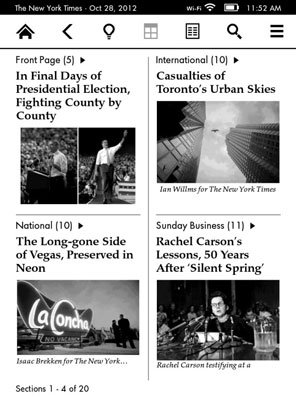
In order to click on window in this screenshot , I will do `click(151, 32)`.